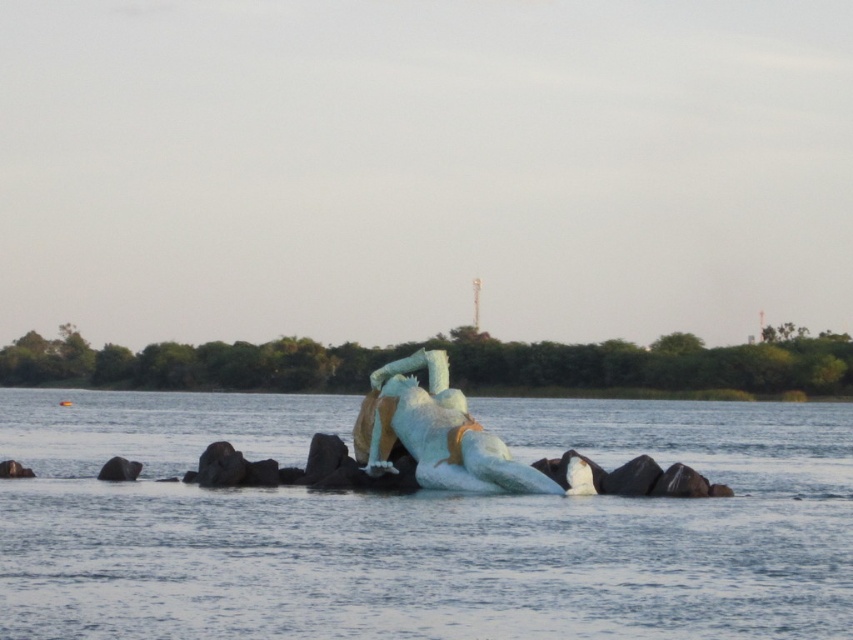
Question: Is translucent white water at center to the right of white matte sculpture at center from the viewer's perspective?

Choices:
 (A) yes
 (B) no

Answer: (B)

Question: Which point appears farthest from the camera in this image?

Choices:
 (A) (215, 433)
 (B) (415, 420)

Answer: (A)

Question: Is the position of translucent white water at center less distant than that of white matte sculpture at center?

Choices:
 (A) no
 (B) yes

Answer: (B)

Question: Which point is farther to the camera?

Choices:
 (A) (480, 451)
 (B) (670, 445)

Answer: (B)

Question: Which object is farther from the camera taking this photo?

Choices:
 (A) translucent white water at center
 (B) white matte sculpture at center

Answer: (B)

Question: Does translucent white water at center have a larger size compared to white matte sculpture at center?

Choices:
 (A) yes
 (B) no

Answer: (A)